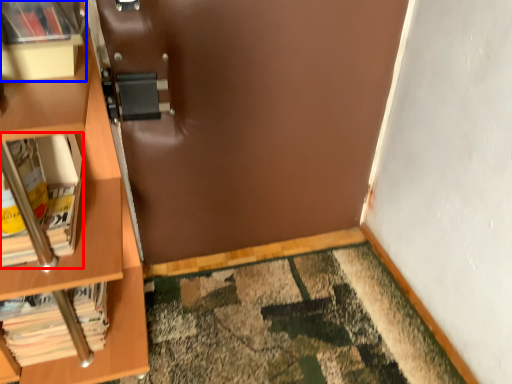
Question: Which of the following is the closest to the observer, book (highlighted by a red box) or shelf (highlighted by a blue box)?

Choices:
 (A) book
 (B) shelf

Answer: (B)